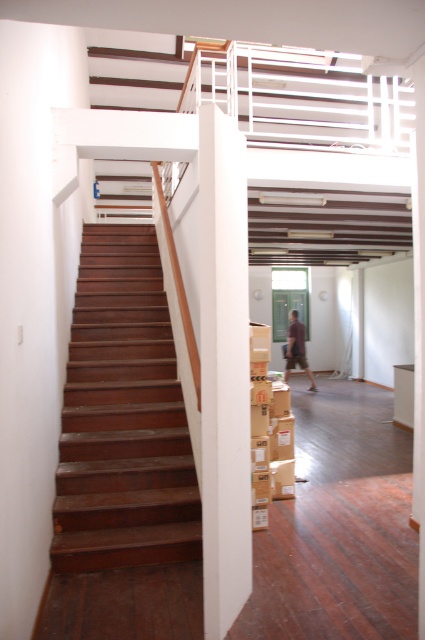
You are moving a large piece of furniture that is 2 meters wide. You need to navigate it through the space between the dark wood stairs at left and the white smooth pillar at center. Based on the scene description, can the furniture fit through this space?

The dark wood stairs at left are wider than the white smooth pillar at center. However, the exact widths aren

You are standing at the entrance of the hallway and want to reach the staircase. According to the image, where exactly is the dark wood stairs at left located?

The dark wood stairs at left is located at point 0.652 on the x axis and 0.289 on the y axis.